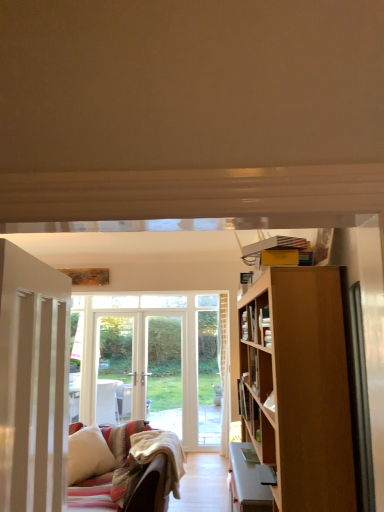
Question: Is hardcover book at center completely or partially inside white wooden door at left?

Choices:
 (A) yes
 (B) no

Answer: (B)

Question: Is white wooden door at left to the left of hardcover book at center from the viewer's perspective?

Choices:
 (A) yes
 (B) no

Answer: (A)

Question: Does white wooden door at left turn towards hardcover book at center?

Choices:
 (A) no
 (B) yes

Answer: (A)

Question: Is white wooden door at left facing away from hardcover book at center?

Choices:
 (A) yes
 (B) no

Answer: (B)

Question: Is white wooden door at left closer to camera compared to hardcover book at center?

Choices:
 (A) no
 (B) yes

Answer: (B)

Question: Can you confirm if white wooden door at left is taller than hardcover book at center?

Choices:
 (A) no
 (B) yes

Answer: (B)

Question: From the image's perspective, is hardcover book at center above white soft pillow at lower left?

Choices:
 (A) yes
 (B) no

Answer: (A)

Question: Is hardcover book at center outside of white soft pillow at lower left?

Choices:
 (A) yes
 (B) no

Answer: (A)

Question: Does hardcover book at center lie behind white soft pillow at lower left?

Choices:
 (A) yes
 (B) no

Answer: (B)

Question: Considering the relative positions of hardcover book at center and white soft pillow at lower left in the image provided, is hardcover book at center to the left of white soft pillow at lower left from the viewer's perspective?

Choices:
 (A) yes
 (B) no

Answer: (B)

Question: Is hardcover book at center shorter than white soft pillow at lower left?

Choices:
 (A) no
 (B) yes

Answer: (B)

Question: Does hardcover book at center have a smaller size compared to white soft pillow at lower left?

Choices:
 (A) yes
 (B) no

Answer: (A)

Question: From the image's perspective, is white soft pillow at lower left located beneath hardcover book at center?

Choices:
 (A) no
 (B) yes

Answer: (B)